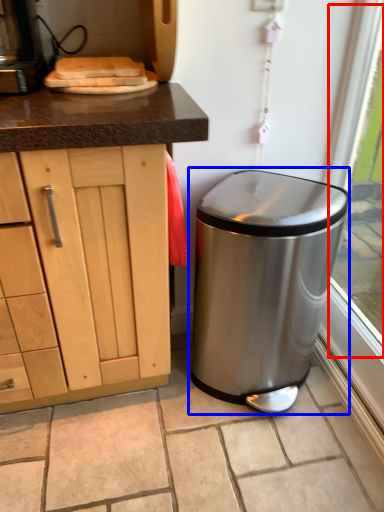
Question: Which point is closer to the camera, window screen (highlighted by a red box) or waste container (highlighted by a blue box)?

Choices:
 (A) window screen
 (B) waste container

Answer: (A)